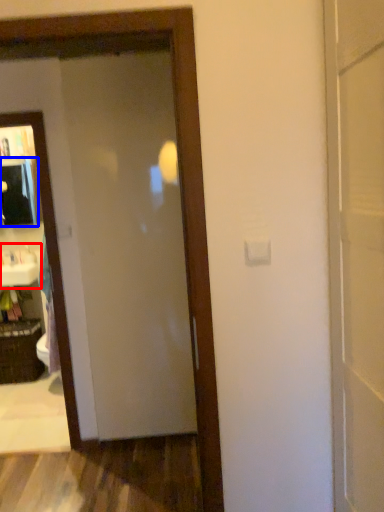
Question: Which object is further to the camera taking this photo, sink (highlighted by a red box) or medicine cabinet (highlighted by a blue box)?

Choices:
 (A) sink
 (B) medicine cabinet

Answer: (B)